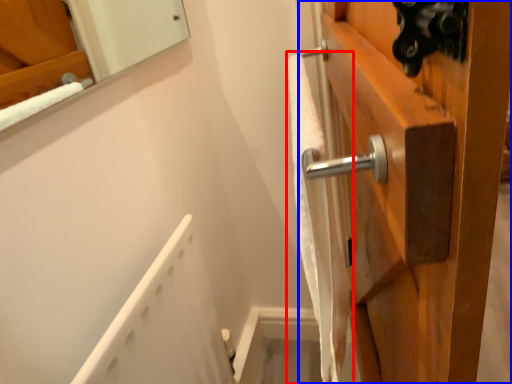
Question: Which object appears farthest to the camera in this image, bath towel (highlighted by a red box) or door (highlighted by a blue box)?

Choices:
 (A) bath towel
 (B) door

Answer: (B)